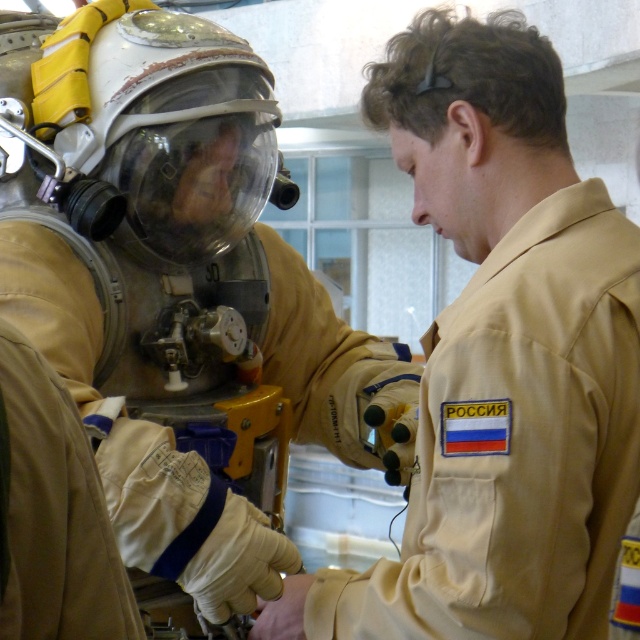
Question: Which of the following is the closest to the observer?

Choices:
 (A) (278, 550)
 (B) (611, 426)

Answer: (B)

Question: Can you confirm if beige fabric uniform at center is positioned to the right of tan fabric uniform at center?

Choices:
 (A) yes
 (B) no

Answer: (B)

Question: From the image, what is the correct spatial relationship of beige fabric uniform at center in relation to tan fabric uniform at center?

Choices:
 (A) left
 (B) right

Answer: (A)

Question: Considering the relative positions of beige fabric uniform at center and tan fabric uniform at center in the image provided, where is beige fabric uniform at center located with respect to tan fabric uniform at center?

Choices:
 (A) below
 (B) above

Answer: (B)

Question: Among these objects, which one is nearest to the camera?

Choices:
 (A) beige fabric uniform at center
 (B) tan fabric uniform at center

Answer: (B)

Question: Which point is farther from the camera taking this photo?

Choices:
 (A) click(10, 276)
 (B) click(506, 627)

Answer: (A)